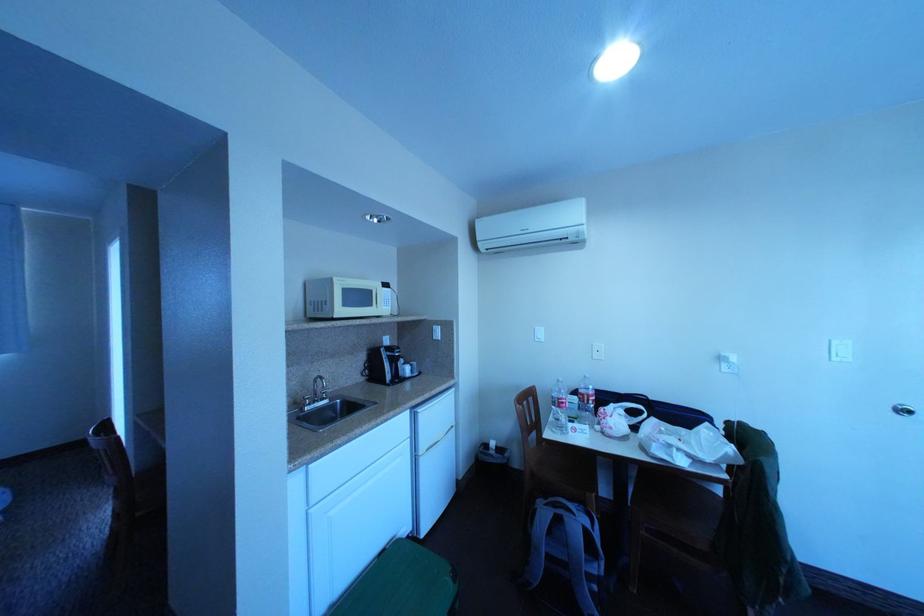
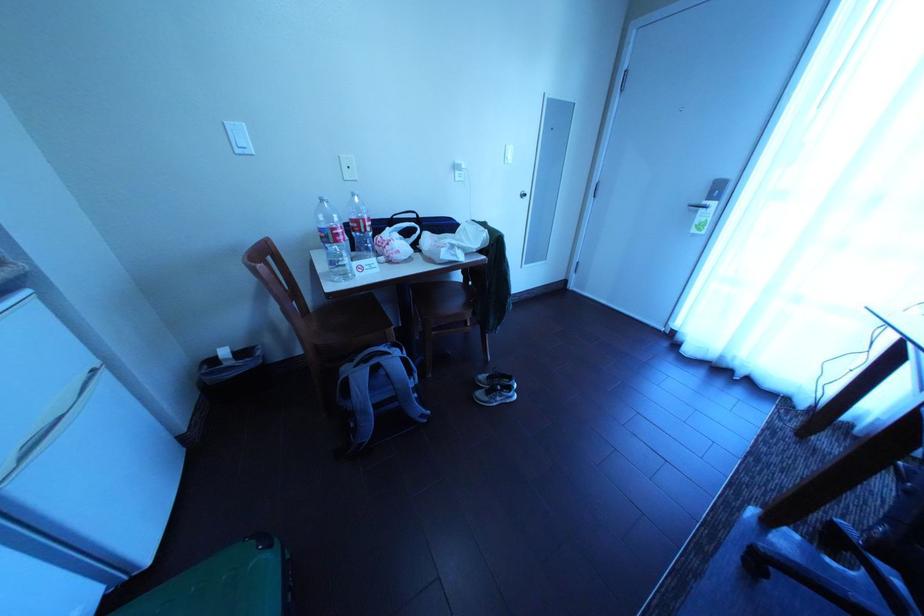
Looking at this image, how did the camera likely rotate?

The rotation direction of the camera is right-down.